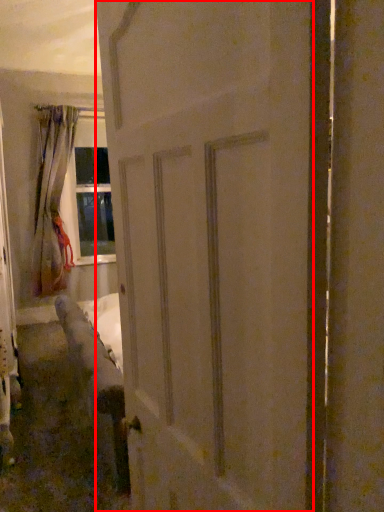
Question: From the image's perspective, where is door (annotated by the red box) located in relation to curtain in the image?

Choices:
 (A) above
 (B) below

Answer: (B)